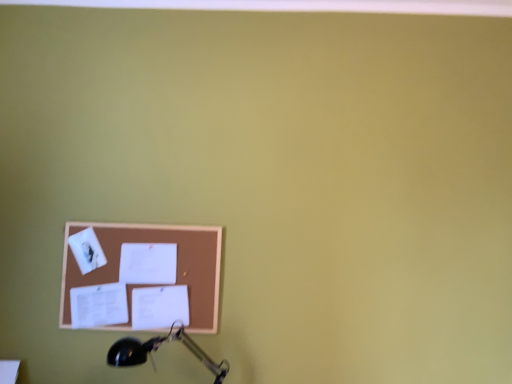
Question: Is black metal table lamp at lower left inside or outside of brown corkboard at lower left?

Choices:
 (A) outside
 (B) inside

Answer: (A)

Question: Would you say black metal table lamp at lower left is to the left or to the right of brown corkboard at lower left in the picture?

Choices:
 (A) right
 (B) left

Answer: (A)

Question: In terms of height, does black metal table lamp at lower left look taller or shorter compared to brown corkboard at lower left?

Choices:
 (A) short
 (B) tall

Answer: (A)

Question: From a real-world perspective, is brown corkboard at lower left positioned above or below black metal table lamp at lower left?

Choices:
 (A) below
 (B) above

Answer: (B)

Question: Is brown corkboard at lower left wider or thinner than black metal table lamp at lower left?

Choices:
 (A) thin
 (B) wide

Answer: (A)

Question: Is brown corkboard at lower left taller or shorter than black metal table lamp at lower left?

Choices:
 (A) tall
 (B) short

Answer: (A)

Question: From the image's perspective, is brown corkboard at lower left above or below black metal table lamp at lower left?

Choices:
 (A) above
 (B) below

Answer: (A)